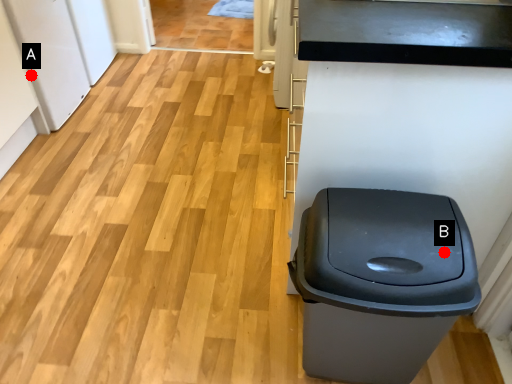
Question: Two points are circled on the image, labeled by A and B beside each circle. Which point is closer to the camera taking this photo?

Choices:
 (A) A is closer
 (B) B is closer

Answer: (B)